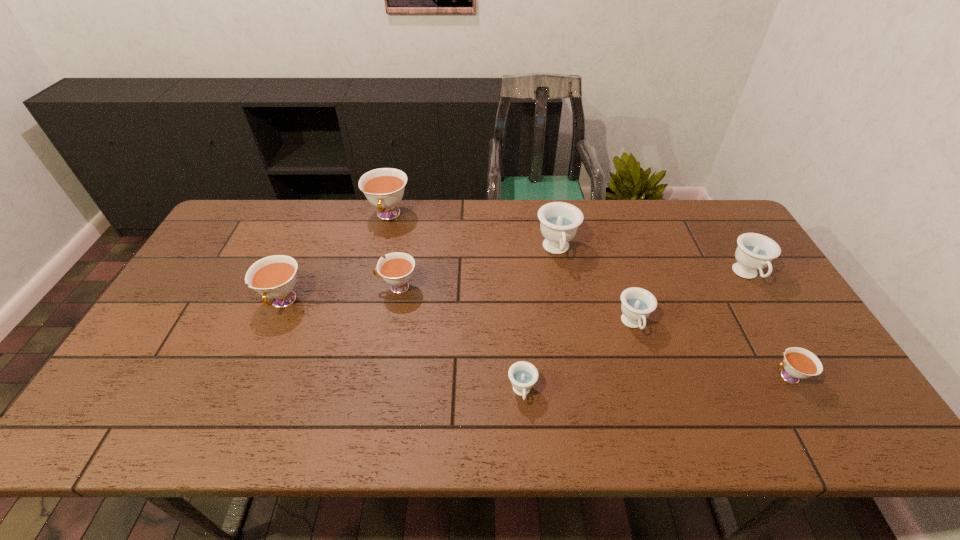
Where is `the farthest white teacup`? The height and width of the screenshot is (540, 960). the farthest white teacup is located at coordinates (384, 188).

Where is `the biggest white teacup`? This screenshot has width=960, height=540. the biggest white teacup is located at coordinates (384, 188).

In order to click on the second blue teacup from left to right in this screenshot , I will do `click(559, 221)`.

Find the location of a particular element. the fifth object from left to right is located at coordinates (559, 221).

Where is `the leftmost object`? The image size is (960, 540). the leftmost object is located at coordinates (274, 277).

At what (x,y) coordinates should I click in order to perform the action: click on the second biggest white teacup. Please return your answer as a coordinate pair (x, y). This screenshot has height=540, width=960. Looking at the image, I should click on (274, 277).

Locate an element on the screen. Image resolution: width=960 pixels, height=540 pixels. the second biggest blue teacup is located at coordinates (755, 252).

The height and width of the screenshot is (540, 960). I want to click on the second smallest white teacup, so click(396, 270).

Locate an element on the screen. the sixth object from left to right is located at coordinates (637, 303).

Where is `the third teacup from right to left`? the third teacup from right to left is located at coordinates (637, 303).